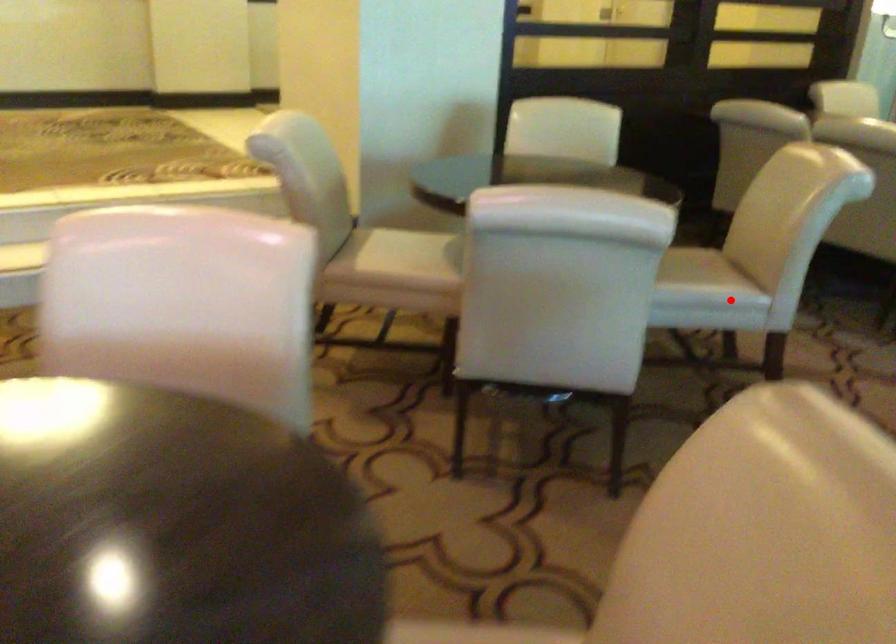
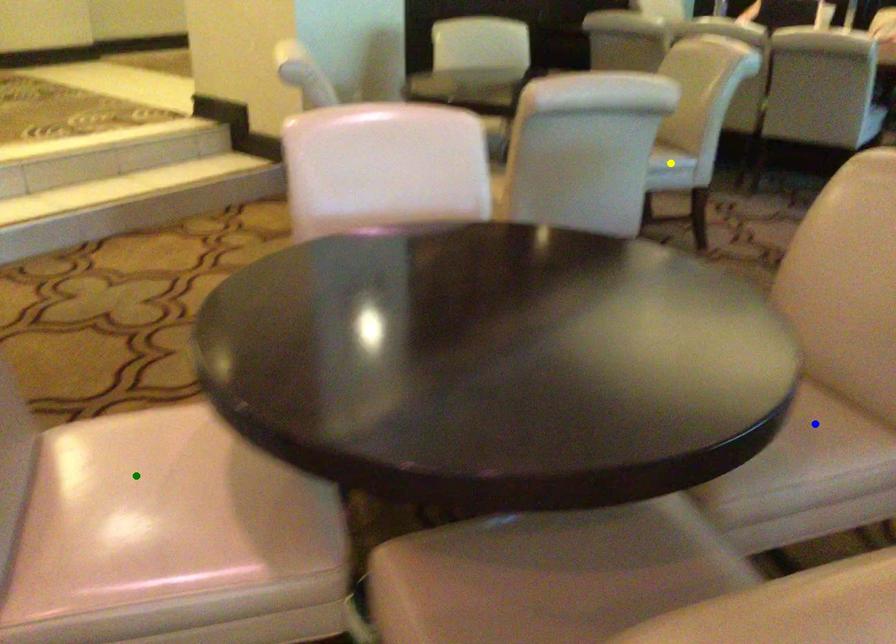
Question: I am providing you with two images of the same scene from different viewpoints. A red point is marked on the first image. You are given multiple points on the second image. Which point in image 2 represents the same 3d spot as the red point in image 1?

Choices:
 (A) green point
 (B) yellow point
 (C) blue point

Answer: (B)